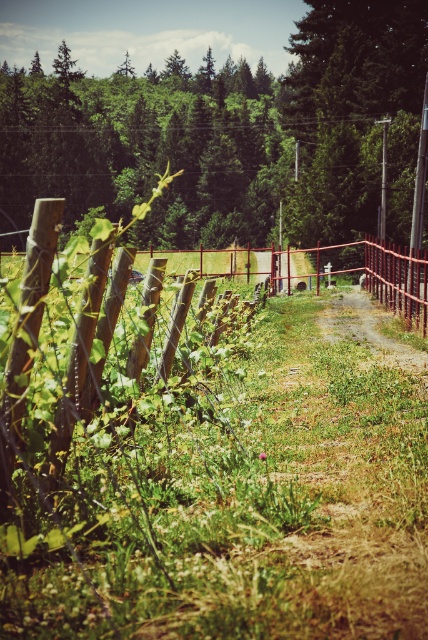
You are standing at the point marked by the coordinates point [237,500] in the image. Based on the scene description, what would you most likely see directly in front of you?

You would see green grass at lower left directly in front of you since the coordinates point [237,500] corresponds to that location.

You are a gardener who wants to plant a new flower in the green grass at lower left. Considering the height of the green leafy tree at upper center, will the flower receive enough sunlight?

The green grass at lower left is shorter than the green leafy tree at upper center, so the flower may not receive enough sunlight because the tree could block some of the light.

You are standing at the edge of the path and see the green grass at lower left and the green leafy tree at upper center. Which object is closer to your right side?

The green grass at lower left is positioned on the right side of green leafy tree at upper center, so the green grass at lower left is closer to your right side.